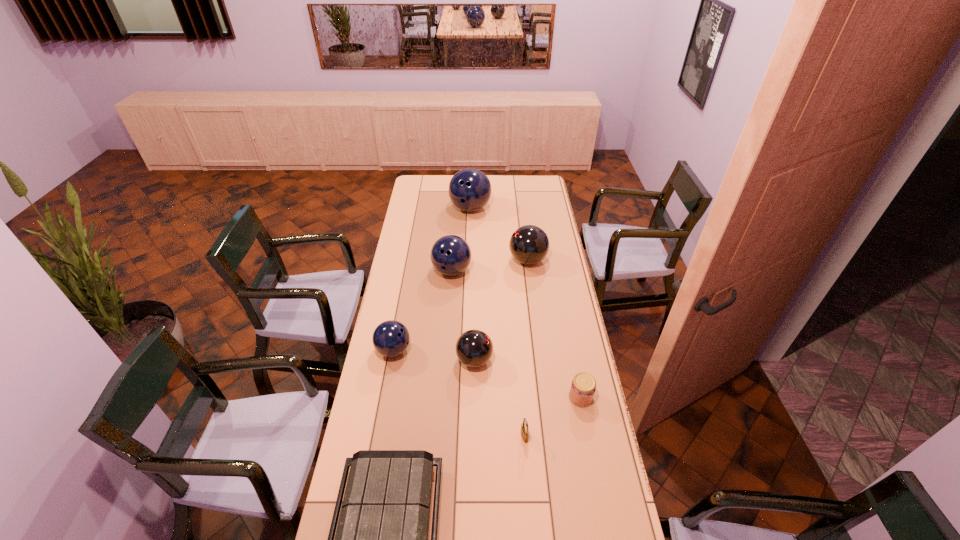
You are a GUI agent. You are given a task and a screenshot of the screen. Output one action in this format:
    pyautogui.click(x=<x>, y=<y>)
    Task: Click on the blue bowling ball that is the second closest to the red jam
    
    Given the screenshot: What is the action you would take?
    pyautogui.click(x=450, y=255)

Find the location of a particular element. free space that satisfies the following two spatial constraints: 1. on the surface of the second smallest blue bowling ball near the finger holes; 2. on the surface of the leftmost blue bowling ball near the finger holes is located at coordinates (446, 350).

The height and width of the screenshot is (540, 960). In order to click on vacant space that satisfies the following two spatial constraints: 1. on the surface of the second nearest blue bowling ball near the finger holes; 2. on the surface of the leftmost blue bowling ball near the finger holes in this screenshot , I will do `click(446, 350)`.

Where is `free space that satisfies the following two spatial constraints: 1. on the surface of the bigger black bowling ball near the finger holes; 2. on the front side of the second nearest object`? Image resolution: width=960 pixels, height=540 pixels. free space that satisfies the following two spatial constraints: 1. on the surface of the bigger black bowling ball near the finger holes; 2. on the front side of the second nearest object is located at coordinates (550, 436).